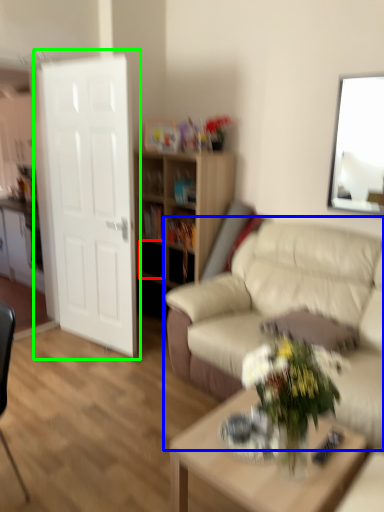
Question: Which is farther away from drawer (highlighted by a red box)? studio couch (highlighted by a blue box) or door (highlighted by a green box)?

Choices:
 (A) studio couch
 (B) door

Answer: (A)